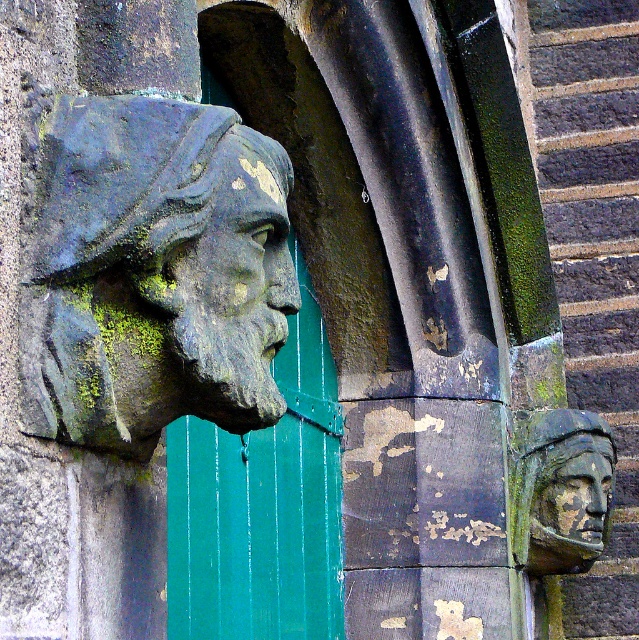
Question: Which point is closer to the camera taking this photo?

Choices:
 (A) (222, 330)
 (B) (325, 566)
 (C) (590, 540)

Answer: (A)

Question: Is green mossy stone head at left smaller than rusty stone head at right?

Choices:
 (A) no
 (B) yes

Answer: (A)

Question: Among these objects, which one is nearest to the camera?

Choices:
 (A) rusty stone face at right
 (B) green mossy stone head at left

Answer: (B)

Question: Does green mossy stone face at upper left have a larger size compared to rusty stone face at right?

Choices:
 (A) no
 (B) yes

Answer: (B)

Question: Can you confirm if green mossy stone head at left is positioned to the left of green mossy stone face at upper left?

Choices:
 (A) yes
 (B) no

Answer: (A)

Question: Which object is positioned farthest from the green mossy stone head at left?

Choices:
 (A) rusty stone face at right
 (B) green painted wood door at center
 (C) rusty stone head at right

Answer: (A)